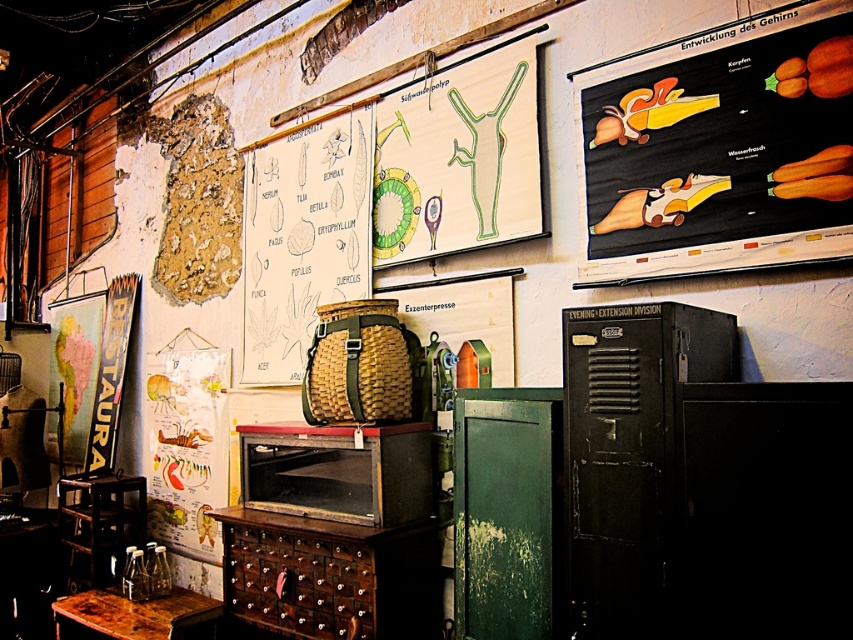
Does yellow paper poster at left have a greater height compared to wooden stool at lower left?

Yes, yellow paper poster at left is taller than wooden stool at lower left.

You are a GUI agent. You are given a task and a screenshot of the screen. Output one action in this format:
    pyautogui.click(x=<x>, y=<y>)
    Task: Click on the yellow paper poster at left
    
    Given the screenshot: What is the action you would take?
    pyautogui.click(x=186, y=445)

Describe the element at coordinates (720, 148) in the screenshot. The image size is (853, 640). I see `black matte poster at upper right` at that location.

Is point (828, 138) positioned before point (358, 113)?

Yes, point (828, 138) is closer to viewer.

Does point (613, 241) lie behind point (283, 246)?

No, it is not.

The height and width of the screenshot is (640, 853). Find the location of `black matte poster at upper right`. black matte poster at upper right is located at coordinates (720, 148).

Can you confirm if green wood drawing at upper center is positioned below white paper at center?

Actually, green wood drawing at upper center is above white paper at center.

Who is positioned more to the left, green wood drawing at upper center or white paper at center?

white paper at center is more to the left.

What do you see at coordinates (457, 157) in the screenshot?
I see `green wood drawing at upper center` at bounding box center [457, 157].

Where is `green wood drawing at upper center`? green wood drawing at upper center is located at coordinates (457, 157).